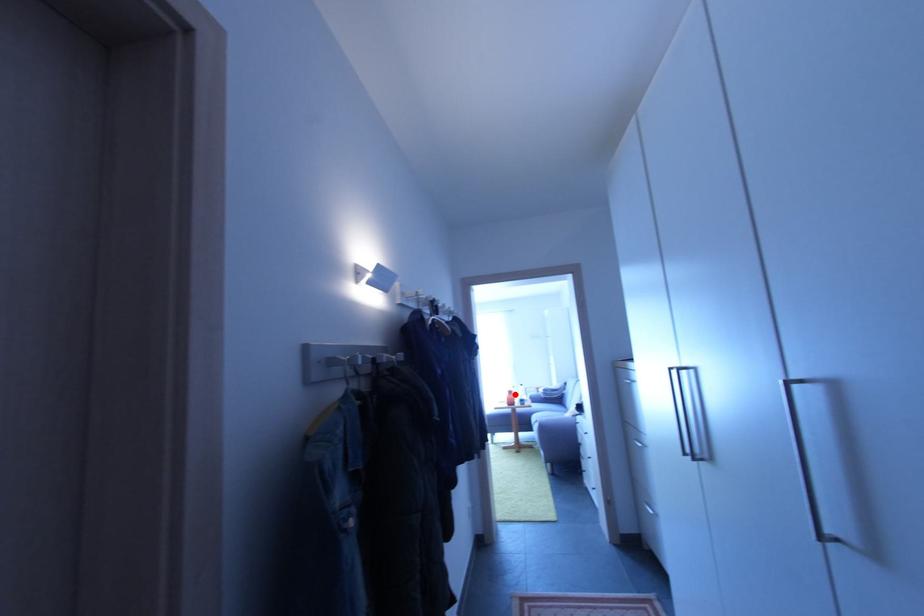
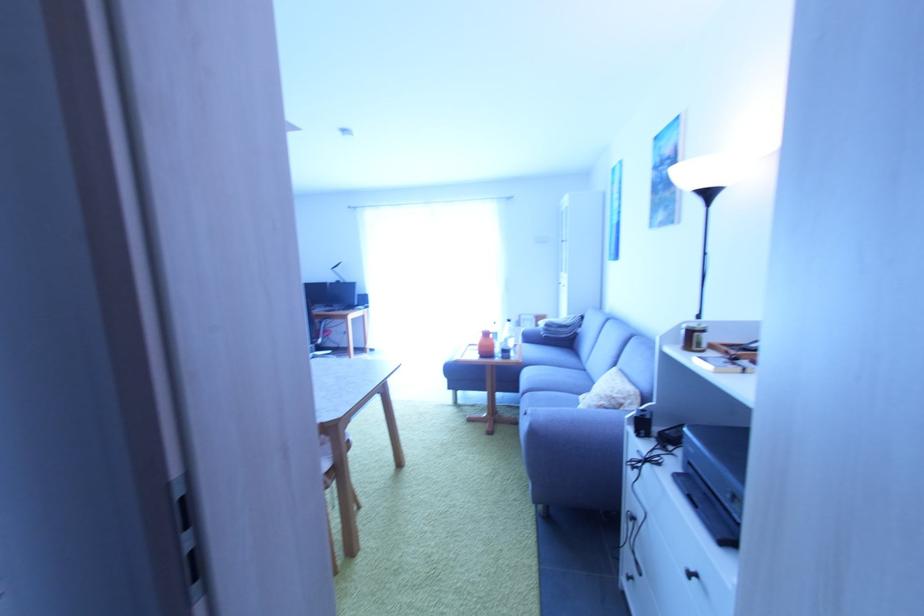
The point at the highlighted location is marked in the first image. Where is the corresponding point in the second image?

(492, 336)